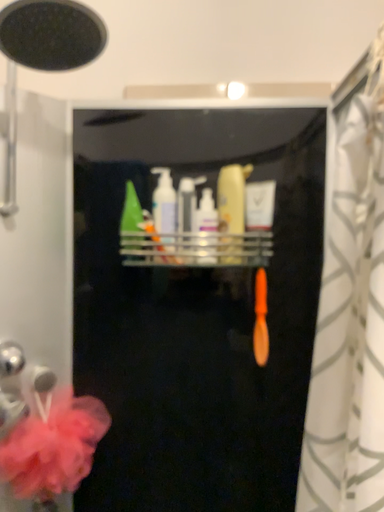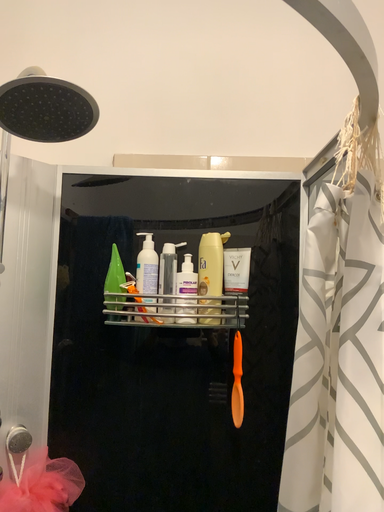
Question: How did the camera likely rotate when shooting the video?

Choices:
 (A) rotated downward
 (B) rotated upward

Answer: (B)